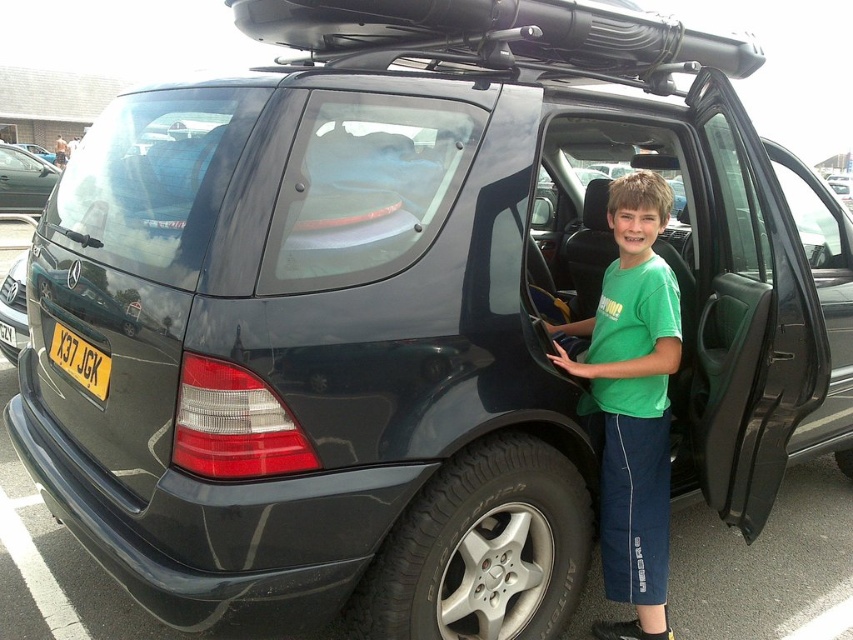
Looking at this image, you are a parking attendant who needs to check if there is enough space between the black rubber tire at lower center and the metallic silver car at left to fit a standard bicycle stand. Can you determine if there is sufficient space?

The black rubber tire at lower center occupies less space than the metallic silver car at left, but the exact dimensions are not provided. Without knowing the distance between them, it is impossible to confirm if there is enough space for a standard bicycle stand.

You are a parking attendant and need to ensure all vehicles are properly aligned. The black rubber tire at lower center and the metallic silver car at left are both in your parking area. Which object is taller?

The metallic silver car at left is taller than the black rubber tire at lower center.